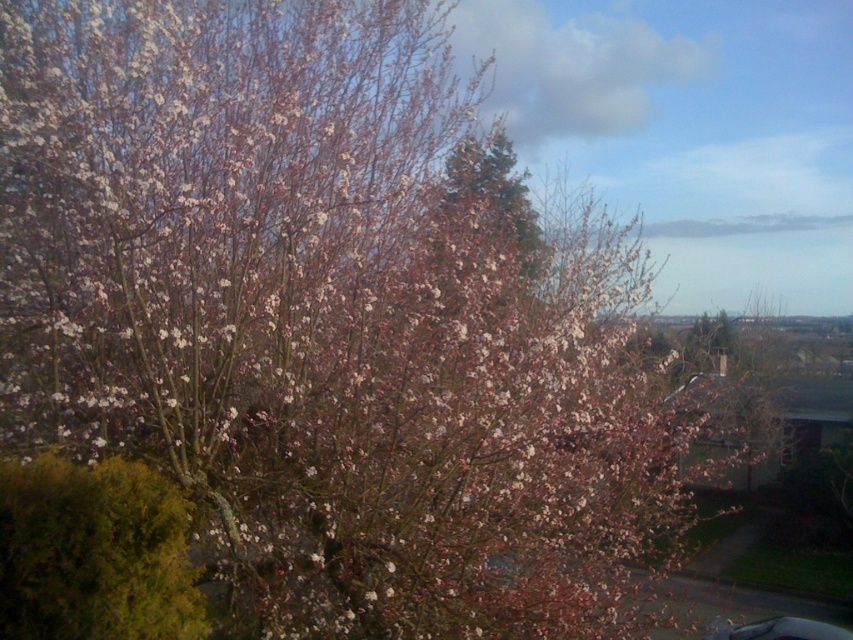
Question: Among these points, which one is farthest from the camera?

Choices:
 (A) (479, 150)
 (B) (86, 579)

Answer: (A)

Question: Does green mossy bush at lower left have a larger size compared to pink blossoms at center?

Choices:
 (A) yes
 (B) no

Answer: (B)

Question: Does green mossy bush at lower left have a greater width compared to pink blossoms at center?

Choices:
 (A) yes
 (B) no

Answer: (B)

Question: Does green mossy bush at lower left have a larger size compared to pink blossoms at center?

Choices:
 (A) no
 (B) yes

Answer: (A)